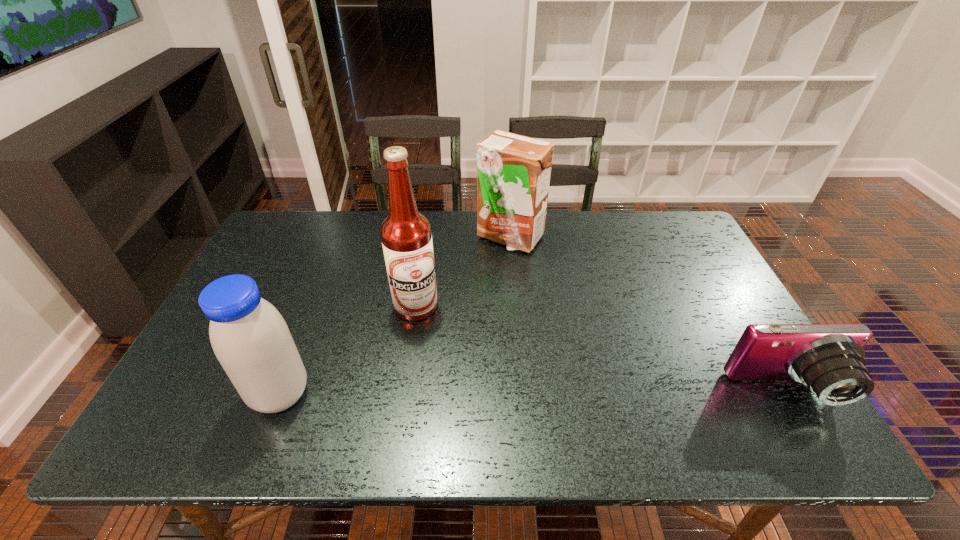
Locate an element on the screen. The height and width of the screenshot is (540, 960). empty space that is in between the carton and the shortest object is located at coordinates (648, 314).

You are a GUI agent. You are given a task and a screenshot of the screen. Output one action in this format:
    pyautogui.click(x=<x>, y=<y>)
    Task: Click on the free space that is in between the third object from right to left and the second object from right to left
    
    Given the screenshot: What is the action you would take?
    pyautogui.click(x=463, y=272)

Where is `free space between the leftmost object and the carton`? This screenshot has height=540, width=960. free space between the leftmost object and the carton is located at coordinates (395, 316).

At what (x,y) coordinates should I click in order to perform the action: click on free space that is in between the tallest object and the soya milk. Please return your answer as a coordinate pair (x, y). This screenshot has width=960, height=540. Looking at the image, I should click on (348, 350).

Identify the location of free space between the shortest object and the carton. The width and height of the screenshot is (960, 540). click(648, 314).

Find the location of a particular element. object that is the second closest one to the third object from right to left is located at coordinates (251, 340).

You are a GUI agent. You are given a task and a screenshot of the screen. Output one action in this format:
    pyautogui.click(x=<x>, y=<y>)
    Task: Click on the object that is the second closest to the soya milk
    
    Given the screenshot: What is the action you would take?
    pyautogui.click(x=513, y=171)

The width and height of the screenshot is (960, 540). In order to click on blank space that satisfies the following two spatial constraints: 1. on the back side of the leftmost object; 2. on the left side of the third object from left to right in this screenshot , I will do `click(341, 237)`.

Where is `free space in the image that satisfies the following two spatial constraints: 1. on the back side of the tallest object; 2. on the left side of the leftmost object`? Image resolution: width=960 pixels, height=540 pixels. free space in the image that satisfies the following two spatial constraints: 1. on the back side of the tallest object; 2. on the left side of the leftmost object is located at coordinates (314, 306).

Find the location of `vacant space that satisfies the following two spatial constraints: 1. on the back side of the soya milk; 2. on the right side of the third nearest object`. vacant space that satisfies the following two spatial constraints: 1. on the back side of the soya milk; 2. on the right side of the third nearest object is located at coordinates (314, 306).